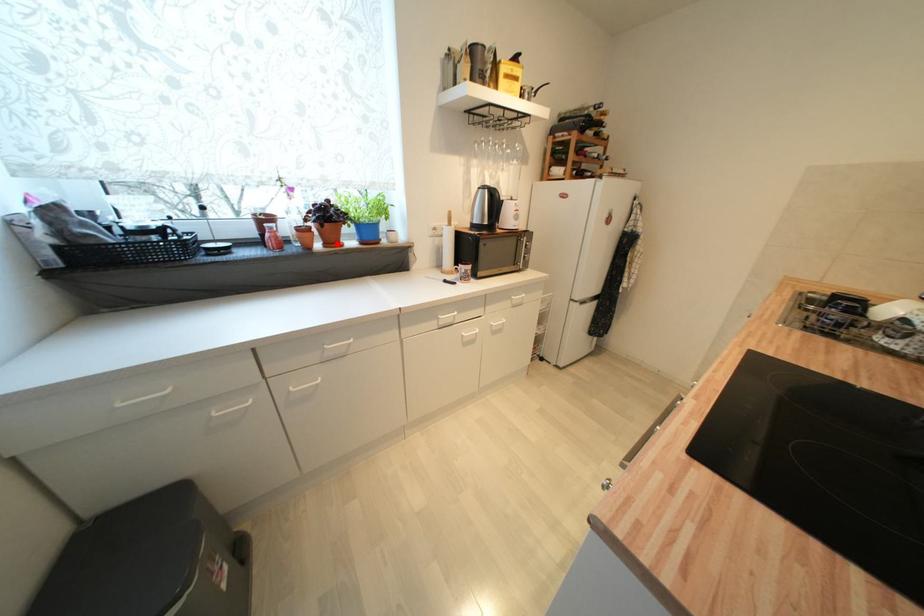
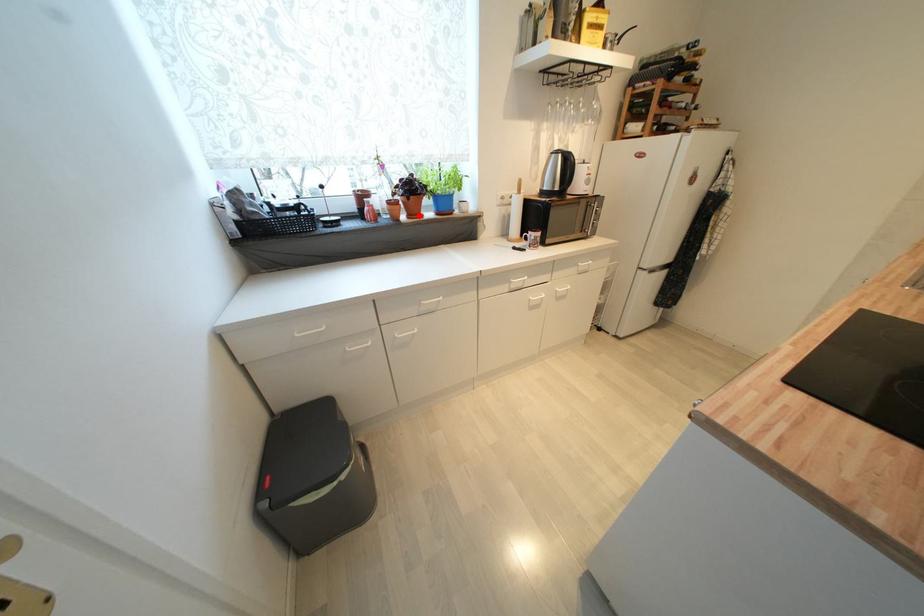
I am providing you with two images of the same scene from different viewpoints. A red point is marked on the first image and another point is marked on the second image. Is the red point in image1 aligned with the point shown in image2?

Yes